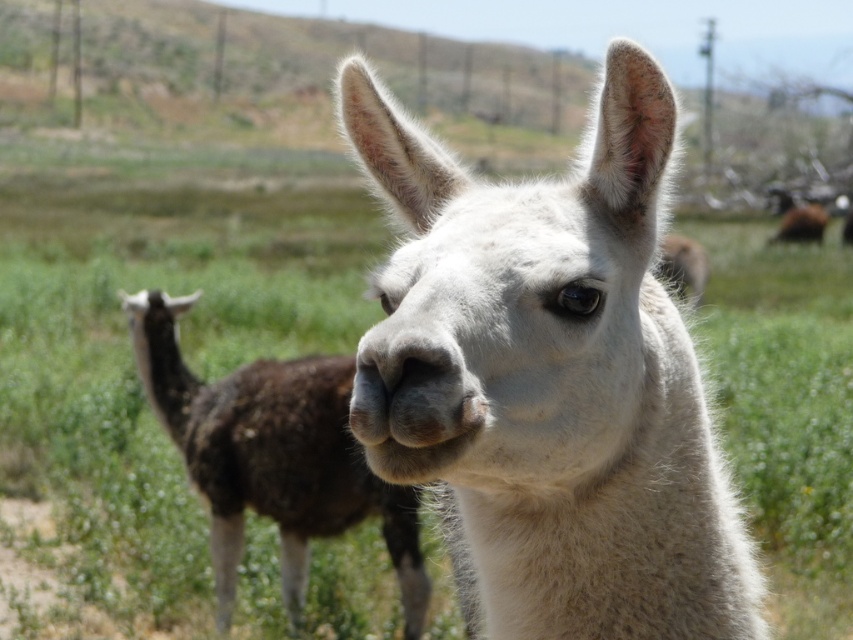
Question: Which point is farther from the camera taking this photo?

Choices:
 (A) (323, 435)
 (B) (463, 225)

Answer: (A)

Question: From the image, what is the correct spatial relationship of white woolen alpaca at center in relation to fuzzy brown alpaca at center?

Choices:
 (A) below
 (B) above

Answer: (B)

Question: Considering the relative positions of white woolen alpaca at center and fuzzy brown alpaca at center in the image provided, where is white woolen alpaca at center located with respect to fuzzy brown alpaca at center?

Choices:
 (A) above
 (B) below

Answer: (A)

Question: Considering the relative positions of white woolen alpaca at center and fuzzy brown alpaca at center in the image provided, where is white woolen alpaca at center located with respect to fuzzy brown alpaca at center?

Choices:
 (A) below
 (B) above

Answer: (B)